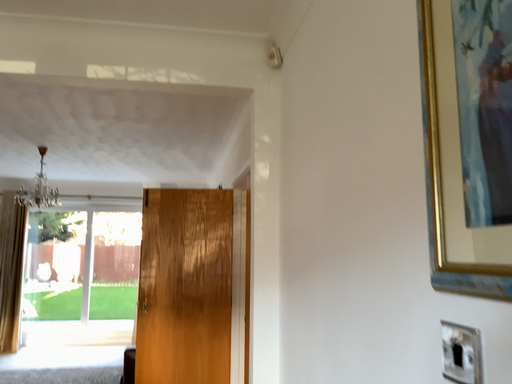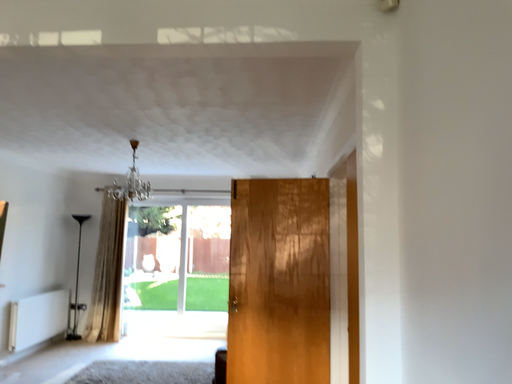
Question: Which way did the camera rotate in the video?

Choices:
 (A) rotated left
 (B) rotated right

Answer: (A)